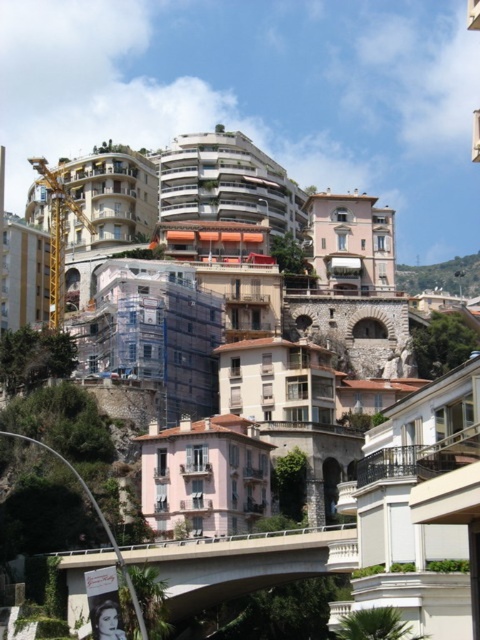
Which is below, yellow metallic crane at left or green stone wall at upper center?

yellow metallic crane at left

Is point (59, 214) positioned in front of point (419, 288)?

Yes, point (59, 214) is in front of point (419, 288).

You are a GUI agent. You are given a task and a screenshot of the screen. Output one action in this format:
    pyautogui.click(x=<x>, y=<y>)
    Task: Click on the yellow metallic crane at left
    Image resolution: width=480 pixels, height=640 pixels.
    Given the screenshot: What is the action you would take?
    point(58,234)

Find the location of a particular element. yellow metallic crane at left is located at coordinates (58, 234).

Does concrete bridge at center have a greater width compared to green stone wall at upper center?

No.

Is concrete bridge at center taller than green stone wall at upper center?

Incorrect, concrete bridge at center's height is not larger of green stone wall at upper center's.

Which is behind, point (70, 593) or point (418, 292)?

The point (418, 292) is behind.

The image size is (480, 640). I want to click on concrete bridge at center, so click(x=242, y=563).

Looking at this image, does concrete bridge at center have a smaller size compared to yellow metallic crane at left?

Correct, concrete bridge at center occupies less space than yellow metallic crane at left.

Who is positioned more to the right, concrete bridge at center or yellow metallic crane at left?

concrete bridge at center is more to the right.

In order to click on concrete bridge at center in this screenshot , I will do `click(242, 563)`.